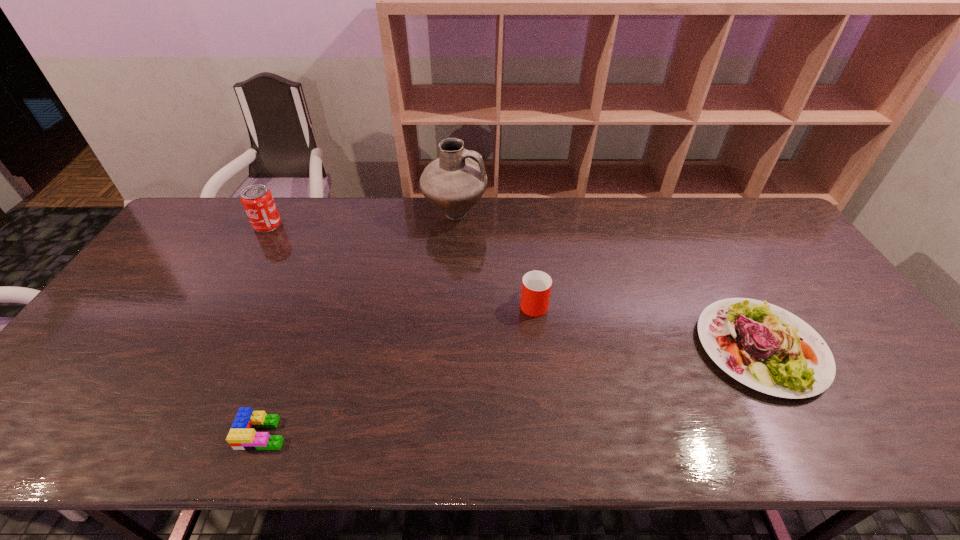
Locate an element on the screen. free space between the shortest object and the rightmost object is located at coordinates (512, 390).

Find the location of a particular element. This screenshot has width=960, height=540. free space between the rightmost object and the fourth object from right to left is located at coordinates (512, 390).

The height and width of the screenshot is (540, 960). I want to click on free space between the leftmost object and the salad plate, so click(x=515, y=286).

You are a GUI agent. You are given a task and a screenshot of the screen. Output one action in this format:
    pyautogui.click(x=<x>, y=<y>)
    Task: Click on the free spot between the rightmost object and the cup
    The height and width of the screenshot is (540, 960).
    Given the screenshot: What is the action you would take?
    pyautogui.click(x=647, y=325)

Find the location of a particular element. Image resolution: width=960 pixels, height=540 pixels. object that ranks as the third closest to the second object from right to left is located at coordinates (242, 436).

Identify which object is the third nearest to the third object from left to right. Please provide its 2D coordinates. Your answer should be formatted as a tuple, i.e. [(x, y)], where the tuple contains the x and y coordinates of a point satisfying the conditions above.

[(765, 347)]

You are a GUI agent. You are given a task and a screenshot of the screen. Output one action in this format:
    pyautogui.click(x=<x>, y=<y>)
    Task: Click on the free spot that satisfies the following two spatial constraints: 1. on the handle side of the pitcher; 2. on the side of the fourth object from left to right with the handle
    The width and height of the screenshot is (960, 540).
    Given the screenshot: What is the action you would take?
    pyautogui.click(x=449, y=302)

You are a GUI agent. You are given a task and a screenshot of the screen. Output one action in this format:
    pyautogui.click(x=<x>, y=<y>)
    Task: Click on the free space in the image that satisfies the following two spatial constraints: 1. on the handle side of the fourth tallest object; 2. on the left side of the pitcher
    The image size is (960, 540).
    Given the screenshot: What is the action you would take?
    pyautogui.click(x=446, y=348)